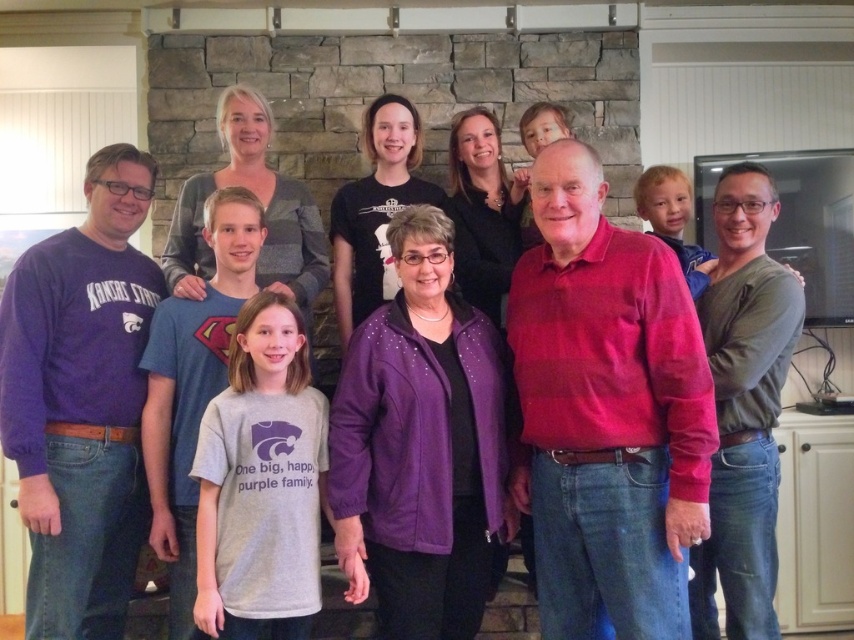
You are a photographer trying to position a new person in the image so they are exactly at the center of the group. Where should you stand relative to the point marked by the coordinates point (607, 410)?

The point (607, 410) marks the matte red sweater at center, so you should position the new person exactly at that point to be at the center of the group.

You are standing in the living room where the photo was taken. You want to place a small decoration exactly at the point with coordinates point (607, 410). Where should you place it?

The point (607, 410) is on the matte red sweater at center, so you should place the decoration on the matte red sweater at center.

You are standing in the living room where the photo was taken. You see two points marked on the wall. The first point is at coordinates point (468,636) and the second is at point (773,442). Which point is closer to you?

Point (468,636) is in front of point (773,442), so the first point is closer to you.